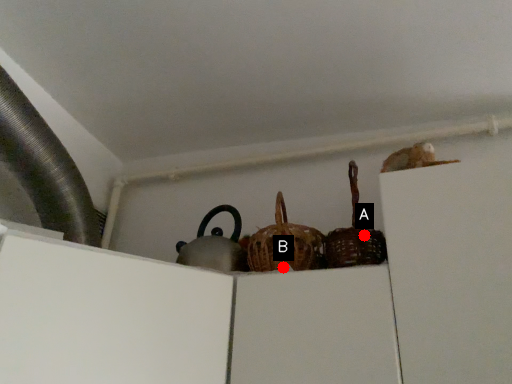
Question: Two points are circled on the image, labeled by A and B beside each circle. Which point is farther to the camera?

Choices:
 (A) A is further
 (B) B is further

Answer: (B)